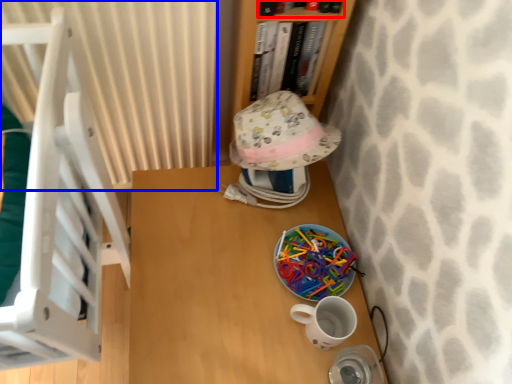
Question: Among these objects, which one is nearest to the camera, book (highlighted by a red box) or curtain (highlighted by a blue box)?

Choices:
 (A) book
 (B) curtain

Answer: (A)